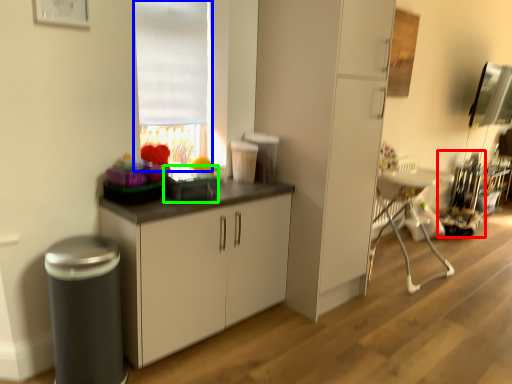
Question: Estimate the real-world distances between objects in this image. Which object is farther from appliance (highlighted by a red box), window (highlighted by a blue box) or appliance (highlighted by a green box)?

Choices:
 (A) window
 (B) appliance

Answer: (B)